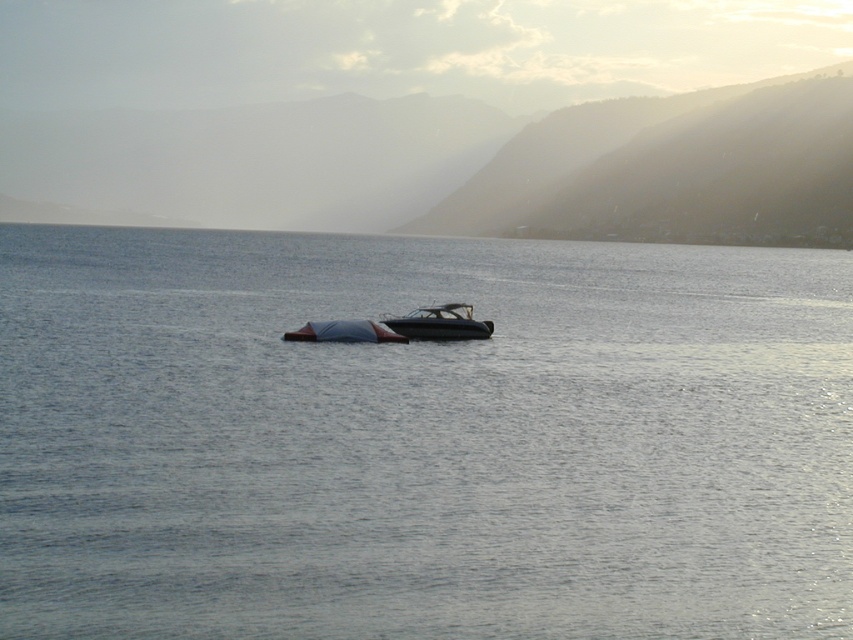
You are standing at the lakeside and want to take a photo of both the point at coordinates point (10, 452) and point (467, 324). Which point should you focus on first to ensure both are in sharp focus?

You should focus on point (10, 452) first because it is closer to the camera than point (467, 324). By focusing on the closer point, the farther point will also be within the depth of field, ensuring both are in focus.

You are standing on the lakeside dock and see two boats in the center of the lake. Which boat is closer to the dock, the glossy black boat at center or the shiny blue boat at center?

The glossy black boat at center is located above the shiny blue boat at center, meaning it is closer to the dock and therefore nearer to you.